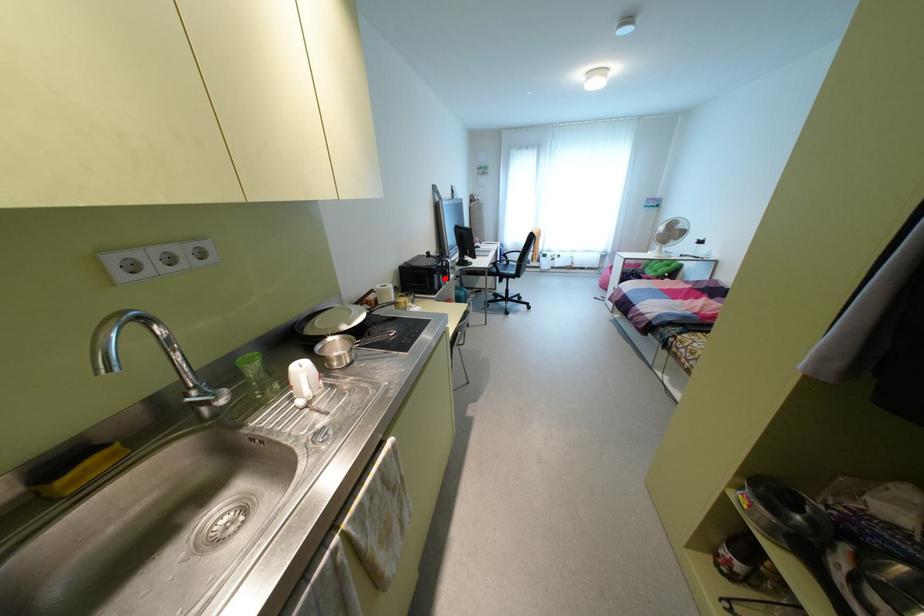
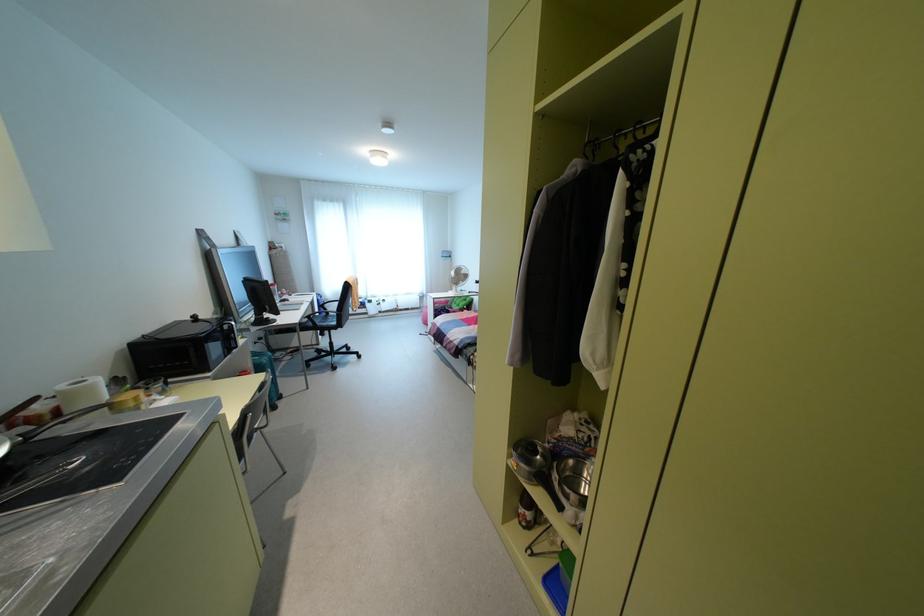
Locate, in the second image, the point that corresponds to the highlighted location in the first image.

(229, 346)